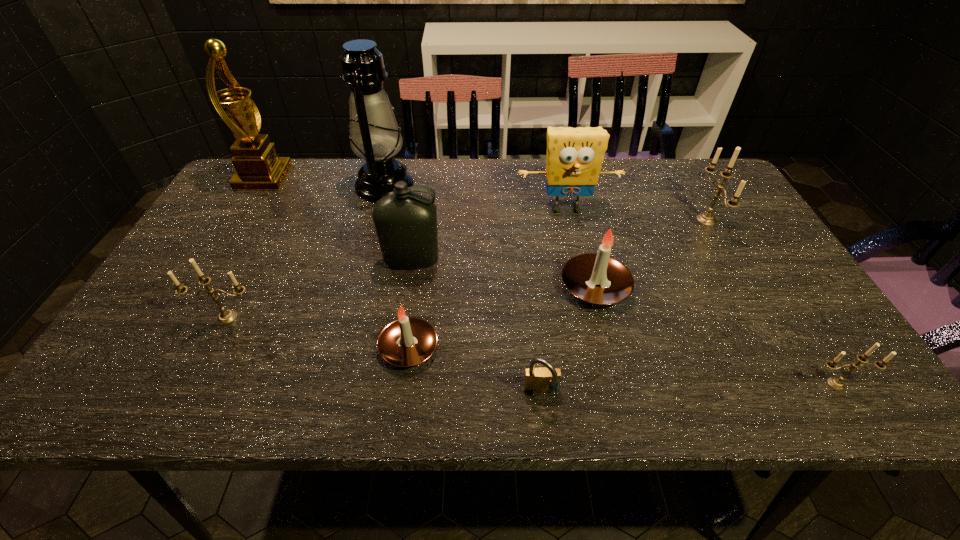
I want to click on oil lamp, so click(x=374, y=134).

You are a GUI agent. You are given a task and a screenshot of the screen. Output one action in this format:
    pyautogui.click(x=<x>, y=<y>)
    Task: Click on the gold award
    The width and height of the screenshot is (960, 540).
    Given the screenshot: What is the action you would take?
    coord(258,167)

Locate an element on the screen. sponge is located at coordinates (574, 159).

Where is `bottle`? The height and width of the screenshot is (540, 960). bottle is located at coordinates (405, 222).

Identify the location of the farthest metallic candle. (707, 219).

The width and height of the screenshot is (960, 540). In order to click on the biggest metallic candle in this screenshot , I will do tap(707, 219).

Locate an element on the screen. the right white candle is located at coordinates (598, 278).

I want to click on the bigger white candle, so click(x=598, y=278).

You are a GUI agent. You are given a task and a screenshot of the screen. Output one action in this format:
    pyautogui.click(x=<x>, y=<y>)
    Task: Click on the second smallest metallic candle
    The height and width of the screenshot is (540, 960).
    Given the screenshot: What is the action you would take?
    pyautogui.click(x=226, y=317)

The height and width of the screenshot is (540, 960). I want to click on the second farthest metallic candle, so click(226, 317).